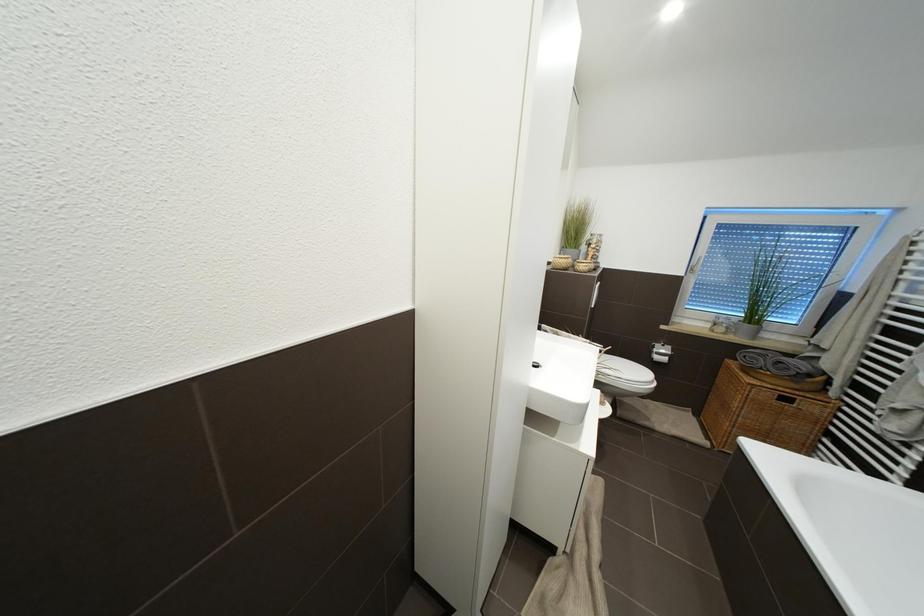
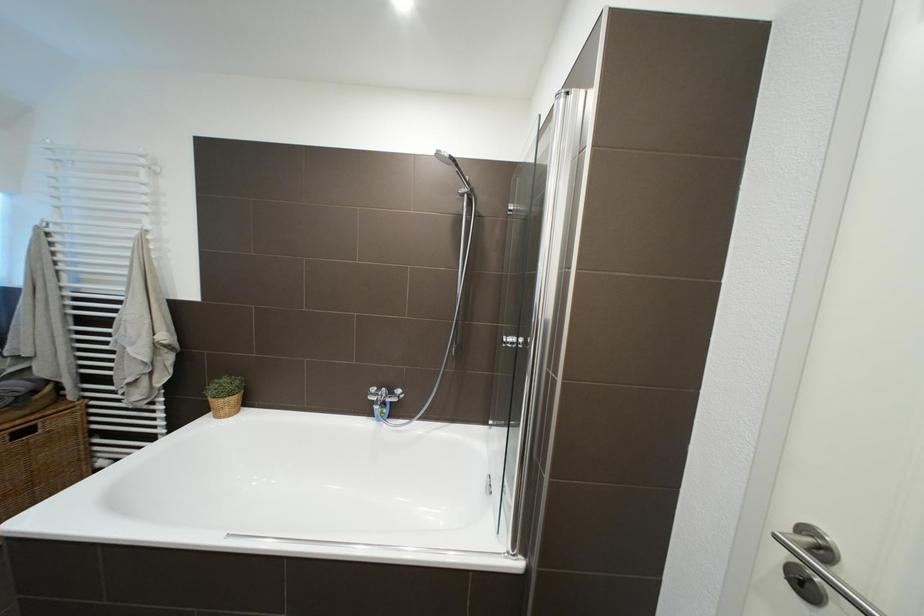
The first image is from the beginning of the video and the second image is from the end. How did the camera likely rotate when shooting the video?

The camera's rotation is toward right-down.